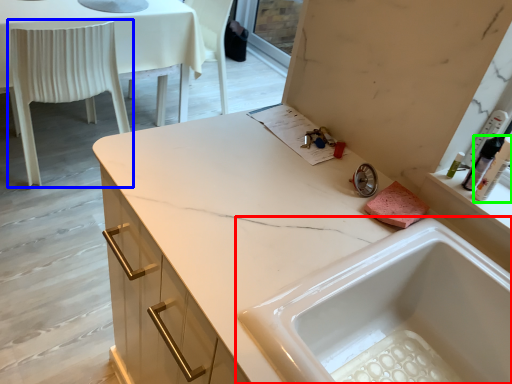
Question: Based on their relative distances, which object is farther from sink (highlighted by a red box)? Choose from chair (highlighted by a blue box) and toiletry (highlighted by a green box).

Choices:
 (A) chair
 (B) toiletry

Answer: (A)